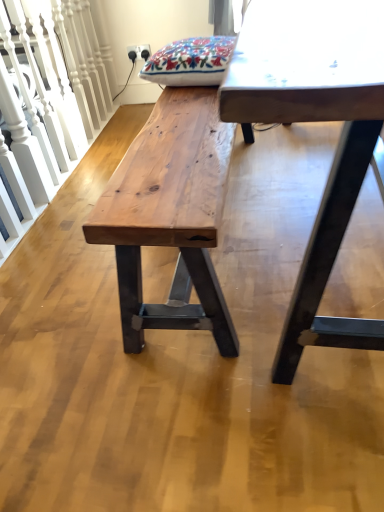
Question: From a real-world perspective, is natural wood bench at left physically located above or below natural wood bench at center?

Choices:
 (A) below
 (B) above

Answer: (B)

Question: Is point (81, 86) closer or farther from the camera than point (157, 181)?

Choices:
 (A) farther
 (B) closer

Answer: (A)

Question: Estimate the real-world distances between objects in this image. Which object is closer to the natural wood bench at center?

Choices:
 (A) natural wood bench at left
 (B) smooth white table at center

Answer: (B)

Question: Which of these objects is positioned farthest from the natural wood bench at left?

Choices:
 (A) natural wood bench at center
 (B) smooth white table at center

Answer: (B)